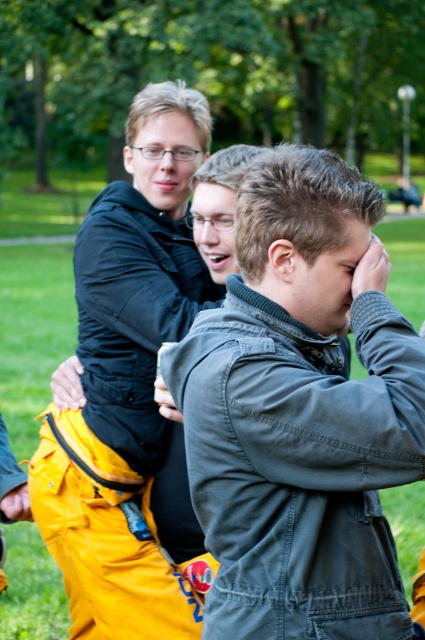
Question: Which object appears farthest from the camera in this image?

Choices:
 (A) dark gray fabric jacket at center
 (B) matte black jacket at left

Answer: (B)

Question: Can you confirm if dark gray fabric jacket at center is positioned below matte black jacket at left?

Choices:
 (A) no
 (B) yes

Answer: (B)

Question: Can you confirm if dark gray fabric jacket at center is wider than matte black jacket at left?

Choices:
 (A) yes
 (B) no

Answer: (B)

Question: Is dark gray fabric jacket at center below matte black jacket at left?

Choices:
 (A) yes
 (B) no

Answer: (A)

Question: Which of the following is the farthest from the observer?

Choices:
 (A) (362, 312)
 (B) (68, 541)

Answer: (B)